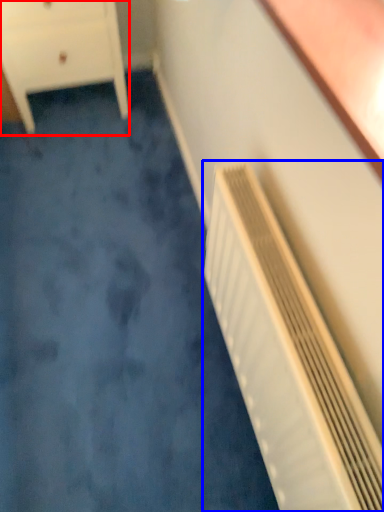
Question: Among these objects, which one is farthest to the camera, chest of drawers (highlighted by a red box) or air conditioning (highlighted by a blue box)?

Choices:
 (A) chest of drawers
 (B) air conditioning

Answer: (A)